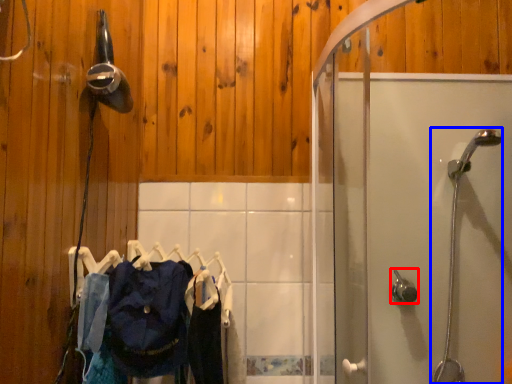
Question: Which object appears closest to the camera in this image, shower (highlighted by a red box) or shower (highlighted by a blue box)?

Choices:
 (A) shower
 (B) shower

Answer: (B)